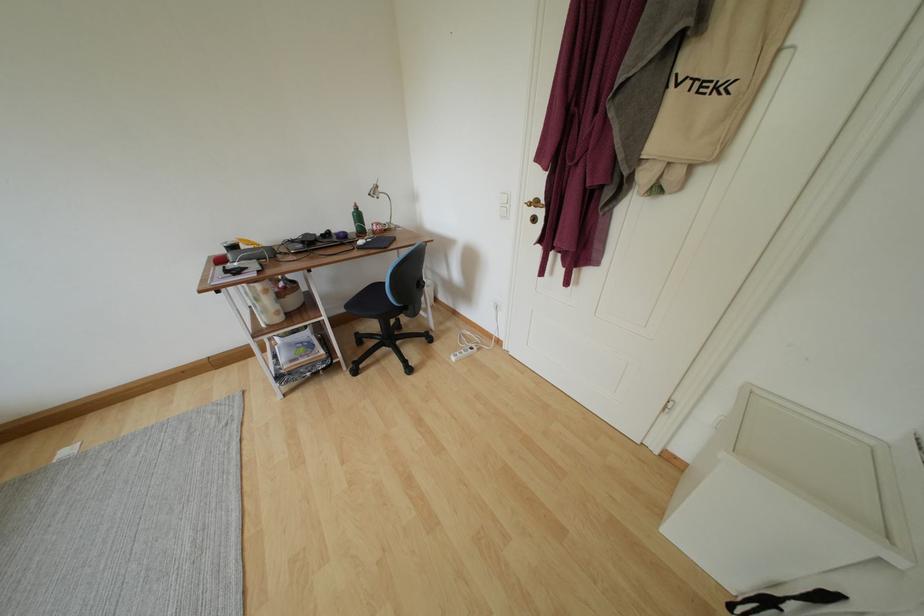
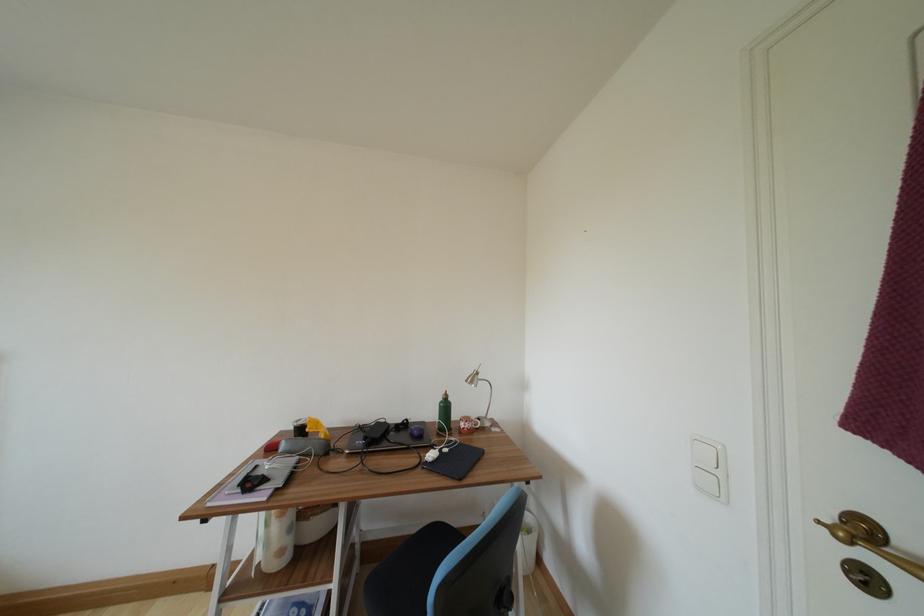
Based on the continuous images, in which direction is the camera rotating?

The camera's rotation is toward left-up.